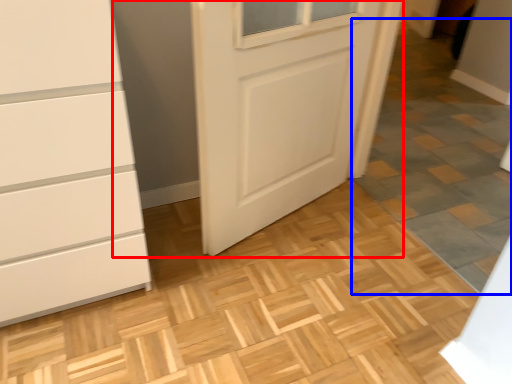
Question: Which point is further to the camera, door (highlighted by a red box) or tile (highlighted by a blue box)?

Choices:
 (A) door
 (B) tile

Answer: (A)